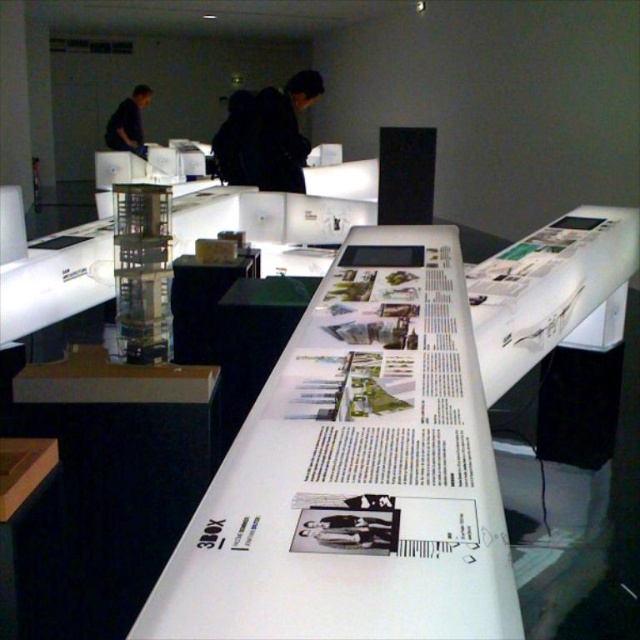
Consider the image. You are standing in the exhibition space and notice two items at the top of the scene. One is a black fabric at upper center and the other is a dark blue shirt at upper left. Which one is located more to the left?

The dark blue shirt at upper left is more to the left.

You are an attendee at the exhibition and want to read the text on the table. Which object, the black fabric at upper center or the dark blue shirt at upper left, is closer to the table?

The black fabric at upper center is closer to the table because it is shorter than the dark blue shirt at upper left.

You are an architect visiting the exhibition and want to examine both the white glossy table at center and the black fabric at upper center. Which object should you approach first to be closer to the other one?

You should approach the black fabric at upper center first because the white glossy table at center is positioned on the right side of it, meaning the black fabric at upper center is closer to the starting point.